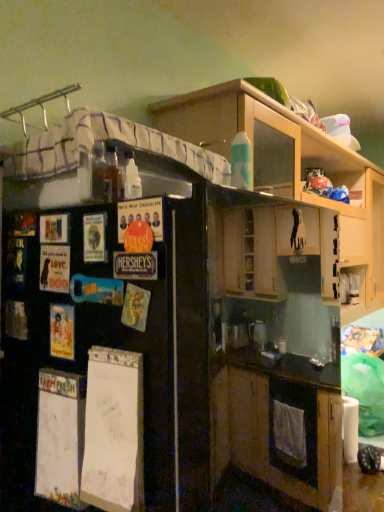
Question: Considering the relative positions of matte paper poster at left, arranged as the third poster when viewed from the front, and black matte refrigerator at left in the image provided, is matte paper poster at left, arranged as the third poster when viewed from the front, in front of black matte refrigerator at left?

Choices:
 (A) yes
 (B) no

Answer: (B)

Question: Is matte paper poster at left, placed as the 1th poster when sorted from left to right, to the left of black matte refrigerator at left from the viewer's perspective?

Choices:
 (A) no
 (B) yes

Answer: (B)

Question: Is matte paper poster at left, arranged as the third poster when viewed from the front, located outside black matte refrigerator at left?

Choices:
 (A) yes
 (B) no

Answer: (B)

Question: Could you tell me if matte paper poster at left, placed as the 1th poster when sorted from back to front, is facing black matte refrigerator at left?

Choices:
 (A) no
 (B) yes

Answer: (B)

Question: Can you confirm if matte paper poster at left, arranged as the third poster when viewed from the front, is bigger than black matte refrigerator at left?

Choices:
 (A) no
 (B) yes

Answer: (A)

Question: From the image's perspective, does matte paper poster at left, positioned as the 2th poster in top-to-bottom order, appear lower than black matte refrigerator at left?

Choices:
 (A) yes
 (B) no

Answer: (B)

Question: Is black matte refrigerator at left smaller than matte paper poster at left, which ranks as the 2th poster in left-to-right order?

Choices:
 (A) yes
 (B) no

Answer: (B)

Question: Considering the relative sizes of black matte refrigerator at left and matte paper poster at left, the 1th poster ordered from the bottom, in the image provided, is black matte refrigerator at left bigger than matte paper poster at left, the 1th poster ordered from the bottom,?

Choices:
 (A) no
 (B) yes

Answer: (B)

Question: Can you confirm if black matte refrigerator at left is positioned to the right of matte paper poster at left, the 1th poster ordered from the bottom?

Choices:
 (A) no
 (B) yes

Answer: (B)

Question: Considering the relative sizes of black matte refrigerator at left and matte paper poster at left, the 1th poster ordered from the bottom, in the image provided, is black matte refrigerator at left shorter than matte paper poster at left, the 1th poster ordered from the bottom,?

Choices:
 (A) no
 (B) yes

Answer: (A)

Question: Are black matte refrigerator at left and matte paper poster at left, marked as the 2th poster in a right-to-left arrangement, far apart?

Choices:
 (A) yes
 (B) no

Answer: (B)

Question: Is black matte refrigerator at left taller than matte paper poster at left, which ranks as the 2th poster in front-to-back order?

Choices:
 (A) yes
 (B) no

Answer: (A)

Question: Does black matte refrigerator at left have a lesser width compared to matte cardboard poster at left, arranged as the first poster when viewed from the right?

Choices:
 (A) no
 (B) yes

Answer: (A)